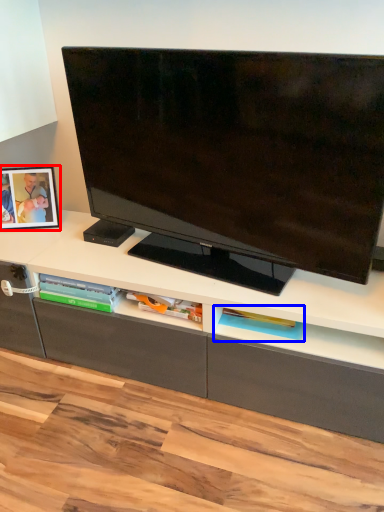
Question: Which of the following is the farthest to the observer, picture frame (highlighted by a red box) or shelf (highlighted by a blue box)?

Choices:
 (A) picture frame
 (B) shelf

Answer: (A)